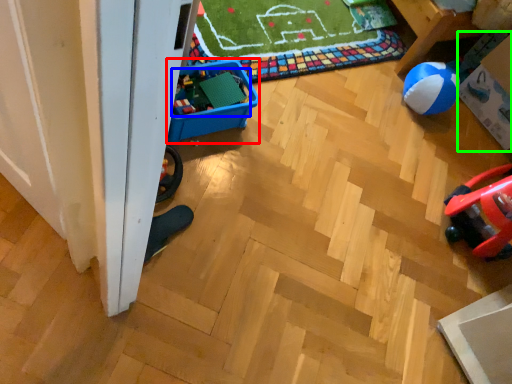
Question: Which is farther away from storage box (highlighted by a red box)? toy (highlighted by a blue box) or storage box (highlighted by a green box)?

Choices:
 (A) toy
 (B) storage box

Answer: (B)